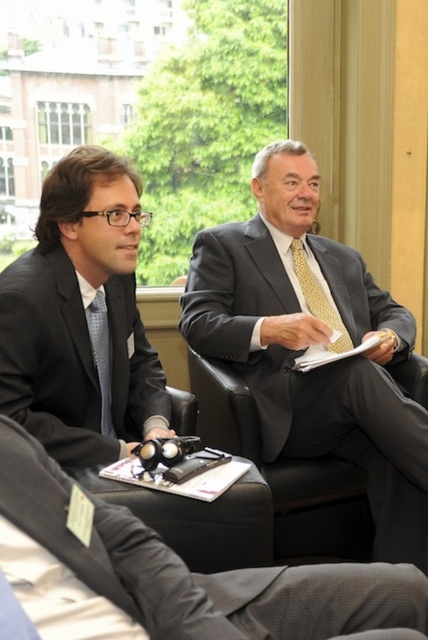
Question: Based on their relative distances, which object is nearer to the yellowtexturetie at center?

Choices:
 (A) matte gray suit at center
 (B) blue dotted tie at left

Answer: (A)

Question: In this image, where is matte black suit at left located relative to blue dotted tie at left?

Choices:
 (A) left
 (B) right

Answer: (A)

Question: Is matte gray suit at center above blue dotted tie at left?

Choices:
 (A) yes
 (B) no

Answer: (A)

Question: Estimate the real-world distances between objects in this image. Which object is closer to the yellowtexturetie at center?

Choices:
 (A) matte gray suit at center
 (B) black matte business suit at center

Answer: (A)

Question: Is black matte business suit at center wider than yellowtexturetie at center?

Choices:
 (A) yes
 (B) no

Answer: (A)

Question: Estimate the real-world distances between objects in this image. Which object is farther from the black matte business suit at center?

Choices:
 (A) matte gray suit at center
 (B) yellowtexturetie at center

Answer: (B)